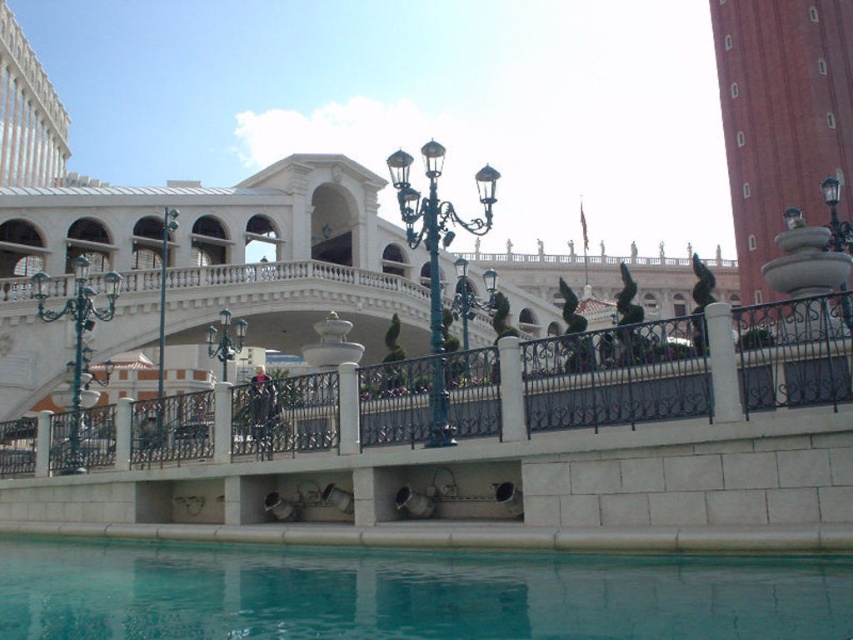
You are a guest at the resort and want to take a photo of the clear glass pool at lower center and the black wrought iron railing at center. Which object should you focus on first if you want to capture both in a single frame without moving the camera?

The clear glass pool at lower center has a smaller size compared to the black wrought iron railing at center, so you should focus on the black wrought iron railing at center first since it is larger and will be more prominent in the frame.

You are standing on the bridge and want to locate the clear glass pool at lower center. According to the coordinates provided, where should you look relative to the bridge?

The clear glass pool at lower center is located at point coordinates of (408, 593). This means it is positioned near the bottom right corner of the image, slightly to the left of the center point in the lower half.